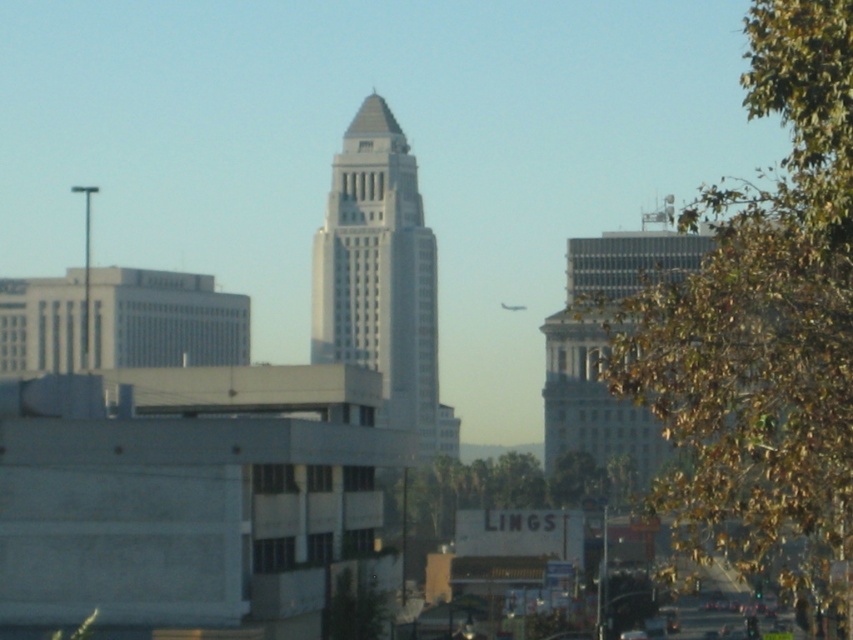
Is point (743, 557) farther from viewer compared to point (317, 356)?

That is False.

Is green leafy tree at upper right in front of white smooth tower at center?

That is True.

Describe the element at coordinates (763, 330) in the screenshot. This screenshot has width=853, height=640. I see `green leafy tree at upper right` at that location.

I want to click on green leafy tree at upper right, so click(x=763, y=330).